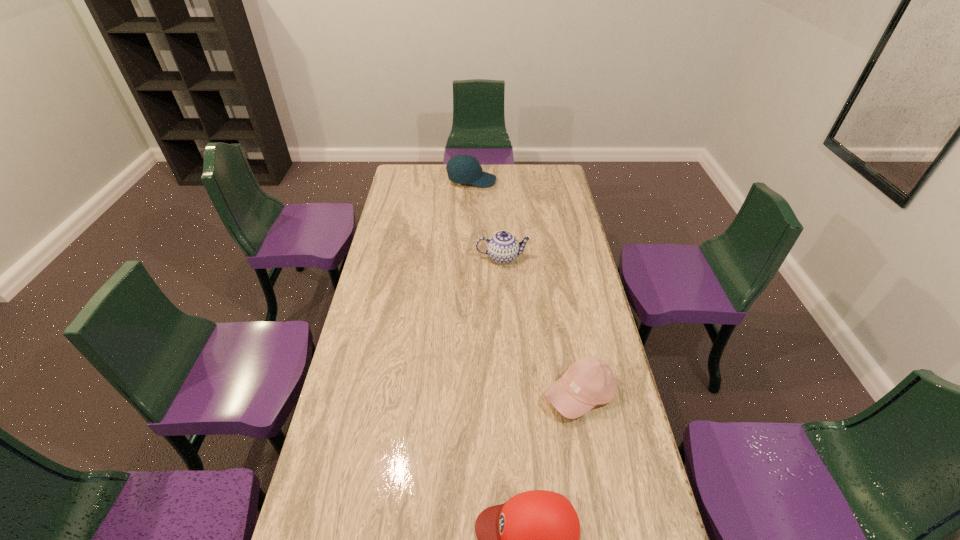
The width and height of the screenshot is (960, 540). In order to click on free location at the right edge in this screenshot , I will do `click(606, 359)`.

Locate an element on the screen. vacant region between the third nearest object and the tallest baseball cap is located at coordinates (487, 219).

Locate an element on the screen. This screenshot has height=540, width=960. free point between the farthest object and the second nearest object is located at coordinates (526, 288).

Locate an element on the screen. This screenshot has width=960, height=540. empty space that is in between the farthest object and the third nearest object is located at coordinates (487, 219).

This screenshot has height=540, width=960. In order to click on vacant area that lies between the third nearest object and the farthest baseball cap in this screenshot , I will do `click(487, 219)`.

At what (x,y) coordinates should I click in order to perform the action: click on free area in between the chinaware and the third farthest object. Please return your answer as a coordinate pair (x, y). Image resolution: width=960 pixels, height=540 pixels. Looking at the image, I should click on (541, 326).

Locate an element on the screen. This screenshot has height=540, width=960. object that is the third closest to the third farthest object is located at coordinates (463, 169).

Locate an element on the screen. object that ranks as the second closest to the nearest object is located at coordinates (503, 247).

Identify the location of the second closest baseball cap to the shortest object. The height and width of the screenshot is (540, 960). (463, 169).

Select which baseball cap appears as the closest to the nearest object. Please provide its 2D coordinates. Your answer should be formatted as a tuple, i.e. [(x, y)], where the tuple contains the x and y coordinates of a point satisfying the conditions above.

[(589, 381)]